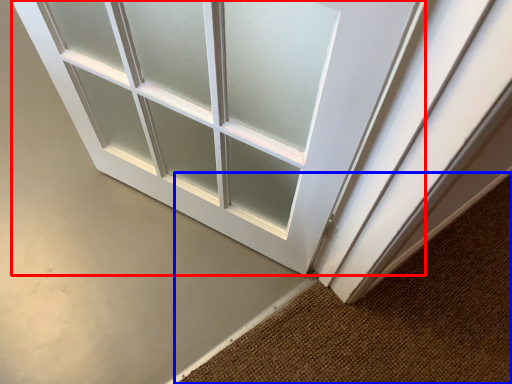
Question: Which point is further to the camera, door (highlighted by a red box) or doormat (highlighted by a blue box)?

Choices:
 (A) door
 (B) doormat

Answer: (A)